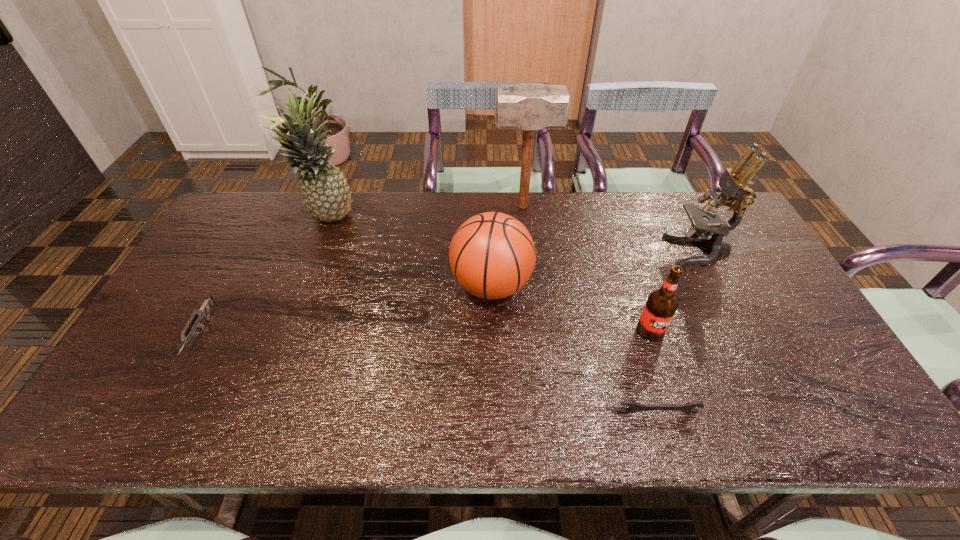
I want to click on mallet that is at the far edge, so click(x=528, y=106).

Find the location of a particular element. The width and height of the screenshot is (960, 540). microscope that is at the far edge is located at coordinates (736, 193).

At what (x,y) coordinates should I click in order to perform the action: click on object positioned at the near edge. Please return your answer as a coordinate pair (x, y). This screenshot has height=540, width=960. Looking at the image, I should click on (689, 408).

Image resolution: width=960 pixels, height=540 pixels. What are the coordinates of `object located in the left edge section of the desktop` in the screenshot? It's located at (203, 312).

Where is `object that is at the right edge`? The width and height of the screenshot is (960, 540). object that is at the right edge is located at coordinates (736, 193).

At what (x,y) coordinates should I click in order to perform the action: click on object that is positioned at the far right corner. Please return your answer as a coordinate pair (x, y). Image resolution: width=960 pixels, height=540 pixels. Looking at the image, I should click on (736, 193).

Locate an element on the screen. This screenshot has width=960, height=540. vacant area at the far edge is located at coordinates (637, 217).

The width and height of the screenshot is (960, 540). Find the location of `vacant area at the near edge of the desktop`. vacant area at the near edge of the desktop is located at coordinates (526, 434).

Locate an element on the screen. The width and height of the screenshot is (960, 540). free point at the left edge is located at coordinates (236, 263).

The width and height of the screenshot is (960, 540). Find the location of `blank space at the far left corner`. blank space at the far left corner is located at coordinates (252, 233).